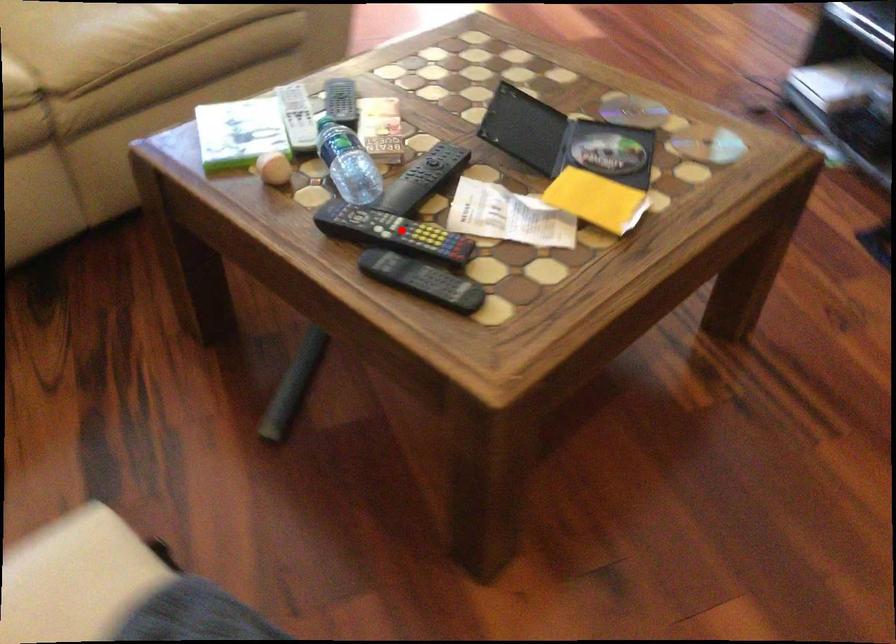
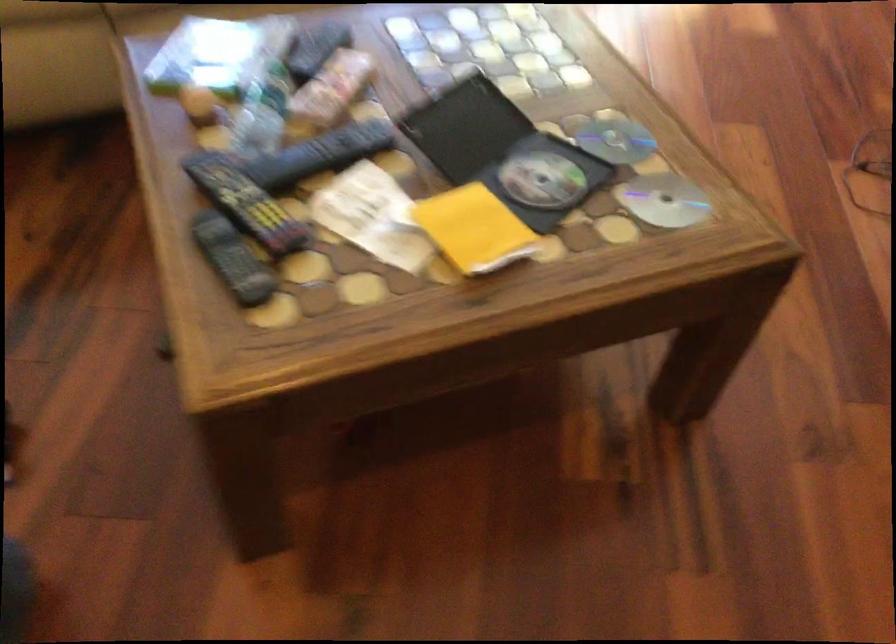
Locate, in the second image, the point that corresponds to the highlighted location in the first image.

(245, 202)